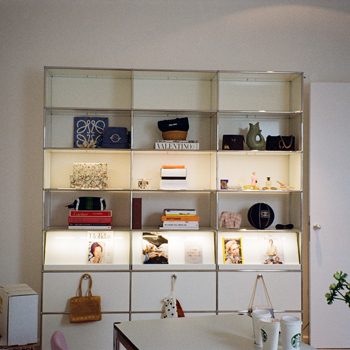
The image size is (350, 350). Identify the location of door handle. pyautogui.click(x=315, y=227).